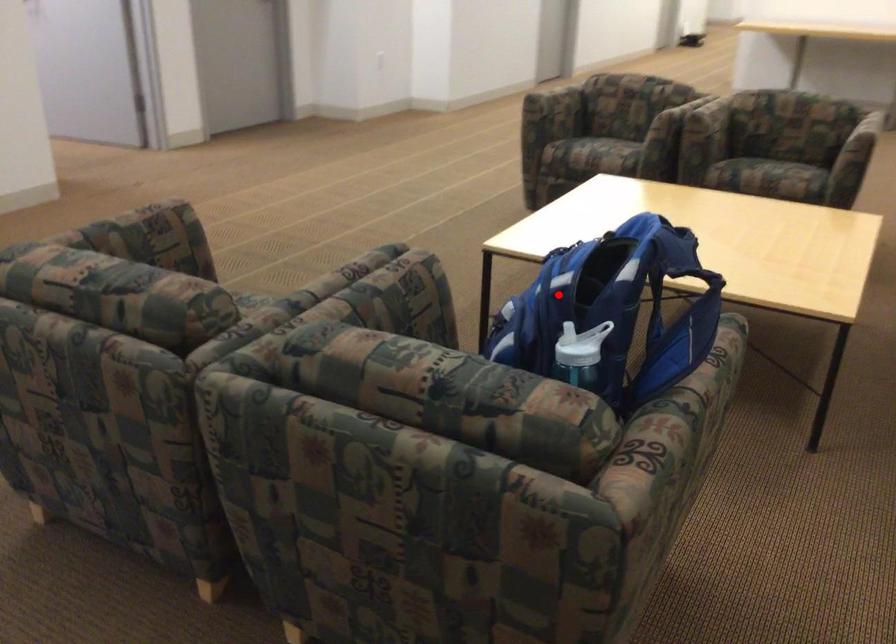
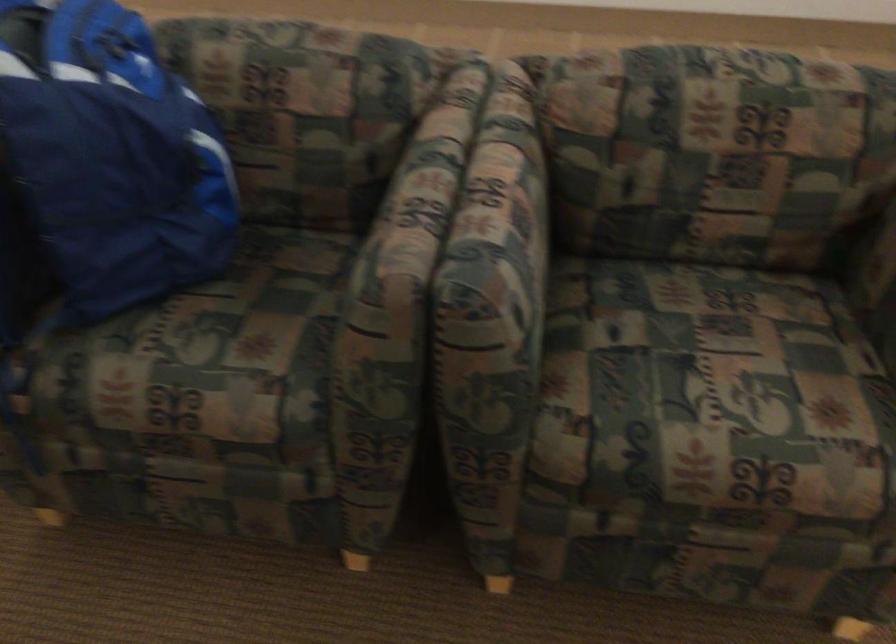
Question: I am providing you with two images of the same scene from different viewpoints. A red point is marked on the first image. Is the red point's position out of view in image 2?

Choices:
 (A) Yes
 (B) No

Answer: (B)